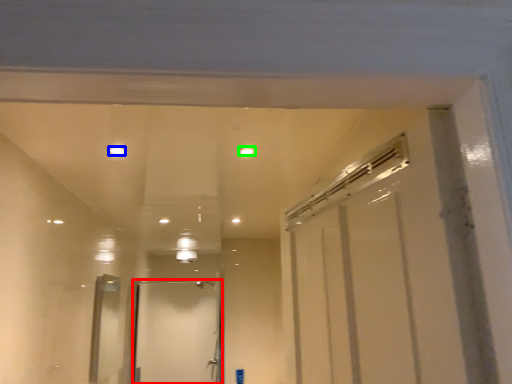
Question: Based on their relative distances, which object is nearer to door (highlighted by a red box)? Choose from light (highlighted by a blue box) and light (highlighted by a green box).

Choices:
 (A) light
 (B) light

Answer: (A)